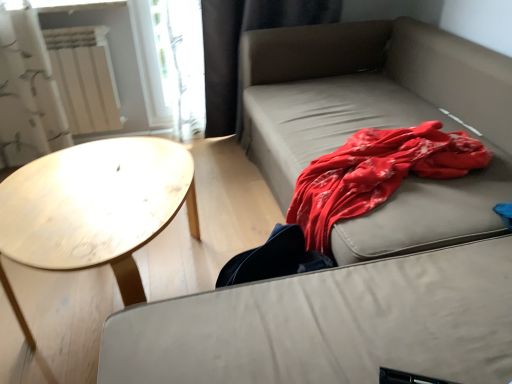
Question: Looking at their shapes, would you say matte beige studio couch at upper right is wider or thinner than black fabric curtain at upper left?

Choices:
 (A) thin
 (B) wide

Answer: (B)

Question: In terms of size, does matte beige studio couch at upper right appear bigger or smaller than black fabric curtain at upper left?

Choices:
 (A) big
 (B) small

Answer: (A)

Question: Which of these objects is positioned farthest from the black fabric curtain at upper left?

Choices:
 (A) light wood/texture coffee table at left
 (B) white matte radiator at upper left
 (C) matte beige studio couch at upper right

Answer: (A)

Question: Which is farther from the light wood/texture coffee table at left?

Choices:
 (A) white matte radiator at upper left
 (B) matte beige studio couch at upper right
 (C) black fabric curtain at upper left

Answer: (C)